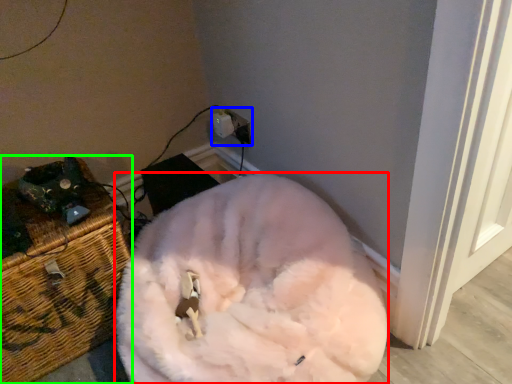
Question: Based on their relative distances, which object is nearer to animal (highlighted by a red box)? Choose from electric outlet (highlighted by a blue box) and furniture (highlighted by a green box).

Choices:
 (A) electric outlet
 (B) furniture

Answer: (B)